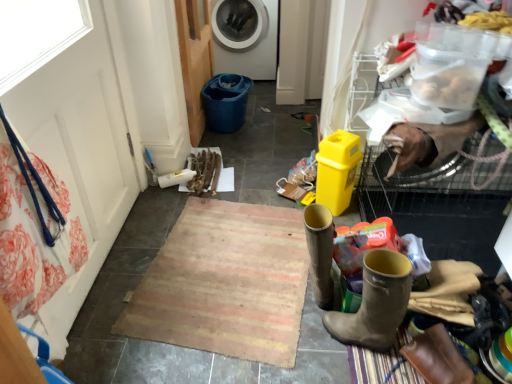
Question: Does white plastic washing machine at upper center come in front of rustic woven mat at center?

Choices:
 (A) yes
 (B) no

Answer: (B)

Question: Is white plastic washing machine at upper center to the right of rustic woven mat at center from the viewer's perspective?

Choices:
 (A) no
 (B) yes

Answer: (A)

Question: Is white plastic washing machine at upper center aimed at rustic woven mat at center?

Choices:
 (A) yes
 (B) no

Answer: (A)

Question: Does white plastic washing machine at upper center contain rustic woven mat at center?

Choices:
 (A) no
 (B) yes

Answer: (A)

Question: Does white plastic washing machine at upper center have a lesser width compared to rustic woven mat at center?

Choices:
 (A) no
 (B) yes

Answer: (A)

Question: Is white plastic washing machine at upper center positioned beyond the bounds of rustic woven mat at center?

Choices:
 (A) no
 (B) yes

Answer: (B)

Question: Considering the relative sizes of white plastic washing machine at upper center and brown leather boot at lower right in the image provided, is white plastic washing machine at upper center bigger than brown leather boot at lower right?

Choices:
 (A) yes
 (B) no

Answer: (A)

Question: Is white plastic washing machine at upper center not near brown leather boot at lower right?

Choices:
 (A) no
 (B) yes

Answer: (B)

Question: Is the depth of white plastic washing machine at upper center greater than that of brown leather boot at lower right?

Choices:
 (A) yes
 (B) no

Answer: (A)

Question: From a real-world perspective, is white plastic washing machine at upper center positioned over brown leather boot at lower right based on gravity?

Choices:
 (A) yes
 (B) no

Answer: (A)

Question: Does white plastic washing machine at upper center have a lesser height compared to brown leather boot at lower right?

Choices:
 (A) no
 (B) yes

Answer: (A)

Question: From the image's perspective, is white plastic washing machine at upper center on top of brown leather boot at lower right?

Choices:
 (A) no
 (B) yes

Answer: (B)

Question: From the image's perspective, is rustic woven mat at center below white plastic washing machine at upper center?

Choices:
 (A) no
 (B) yes

Answer: (B)